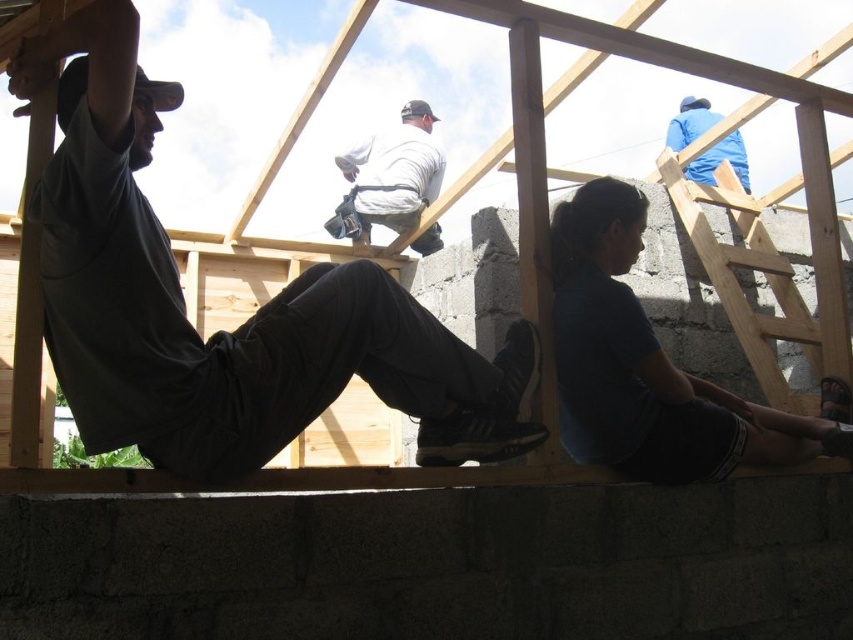
Question: Is dark gray shirt at upper left behind blue fabric at lower right?

Choices:
 (A) no
 (B) yes

Answer: (A)

Question: Does blue fabric at lower right have a greater width compared to blue fabric jacket at upper right?

Choices:
 (A) no
 (B) yes

Answer: (B)

Question: Based on their relative distances, which object is farther from the blue fabric jacket at upper right?

Choices:
 (A) blue fabric at lower right
 (B) dark gray shirt at upper left

Answer: (B)

Question: Is dark gray shirt at upper left positioned at the back of blue fabric jacket at upper right?

Choices:
 (A) yes
 (B) no

Answer: (B)

Question: Among these objects, which one is farthest from the camera?

Choices:
 (A) dark gray shirt at upper left
 (B) blue fabric at lower right
 (C) blue fabric jacket at upper right

Answer: (C)

Question: Considering the real-world distances, which object is farthest from the dark gray shirt at upper left?

Choices:
 (A) white matte shirt at center
 (B) blue fabric at lower right
 (C) blue fabric jacket at upper right

Answer: (C)